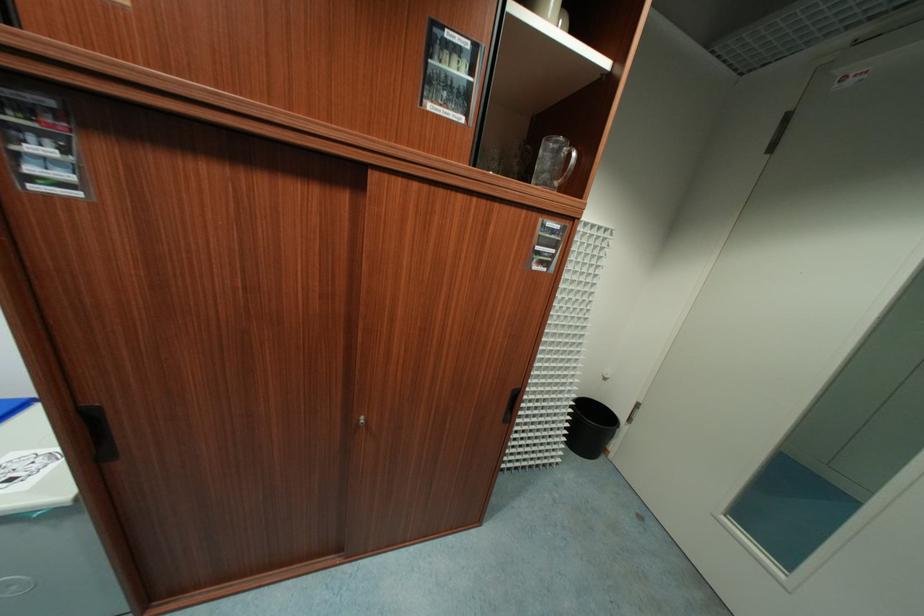
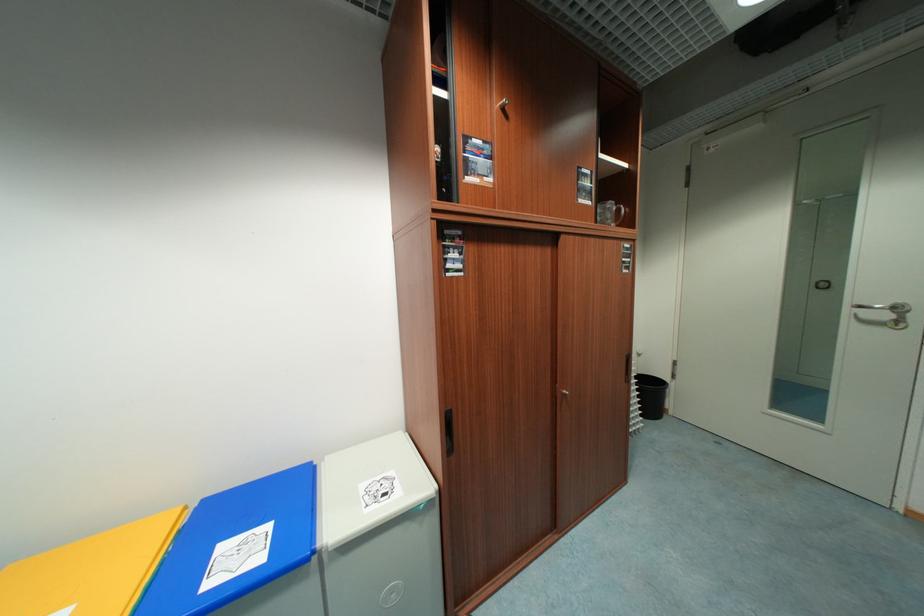
In the second image, find the point that corresponds to (574,158) in the first image.

(624, 211)